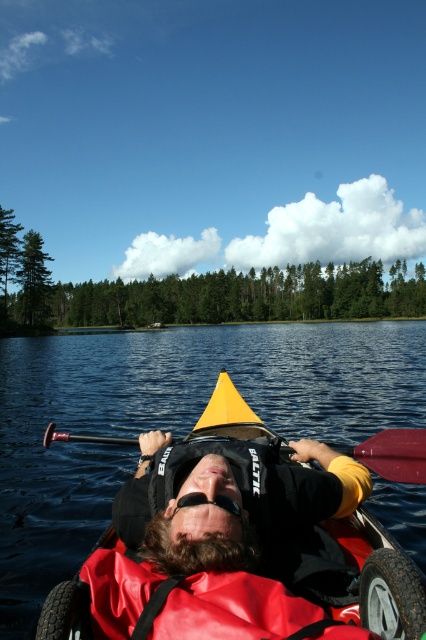
Can you confirm if transparent water at center is positioned above black rubber goggles at center?

Actually, transparent water at center is below black rubber goggles at center.

Is point (239, 356) closer to viewer compared to point (221, 496)?

No, (239, 356) is behind (221, 496).

Locate an element on the screen. transparent water at center is located at coordinates (170, 417).

Based on the photo, is red plastic paddle at center shorter than black rubber goggles at center?

No, red plastic paddle at center is not shorter than black rubber goggles at center.

This screenshot has height=640, width=426. What are the coordinates of `red plastic paddle at center` in the screenshot? It's located at (394, 454).

Can you confirm if transparent water at center is positioned below black matte life vest at center?

Indeed, transparent water at center is positioned under black matte life vest at center.

Who is positioned more to the right, transparent water at center or black matte life vest at center?

transparent water at center

Which is behind, point (359, 422) or point (213, 461)?

Point (359, 422)

What are the coordinates of `transparent water at center` in the screenshot? It's located at (170, 417).